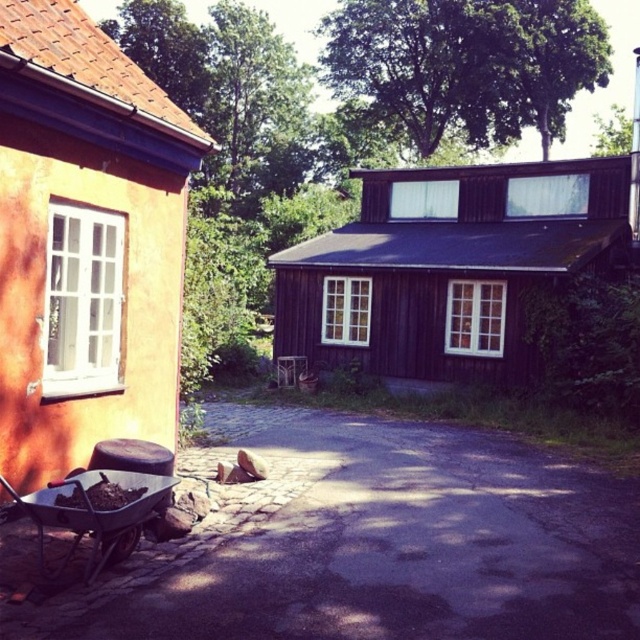
Can you confirm if dark gray asphalt at center is positioned to the right of metallic wheelbarrow at lower left?

Indeed, dark gray asphalt at center is positioned on the right side of metallic wheelbarrow at lower left.

Does dark gray asphalt at center have a greater width compared to metallic wheelbarrow at lower left?

Yes, dark gray asphalt at center is wider than metallic wheelbarrow at lower left.

Between point (602, 484) and point (108, 508), which one is positioned behind?

The point (602, 484) is more distant.

Identify the location of dark gray asphalt at center. (369, 545).